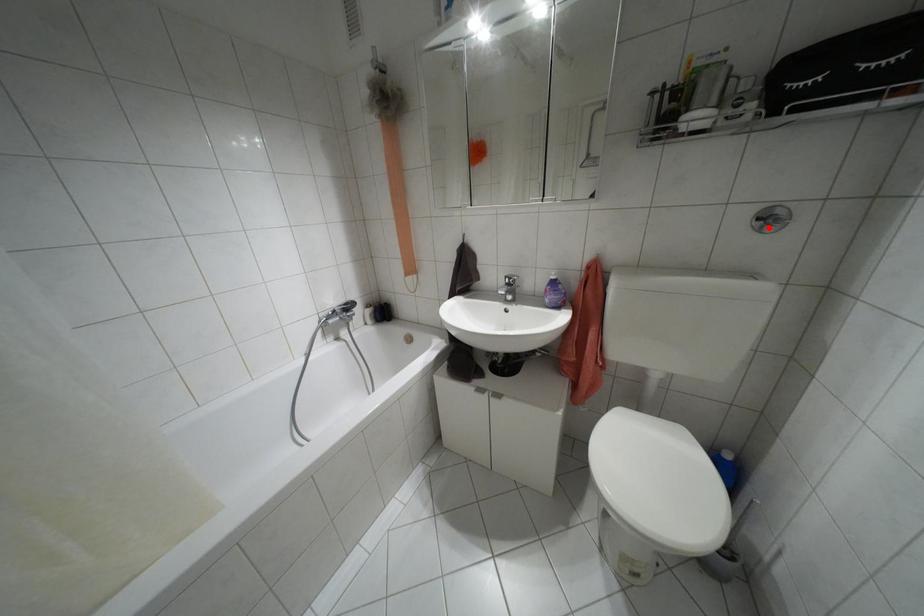
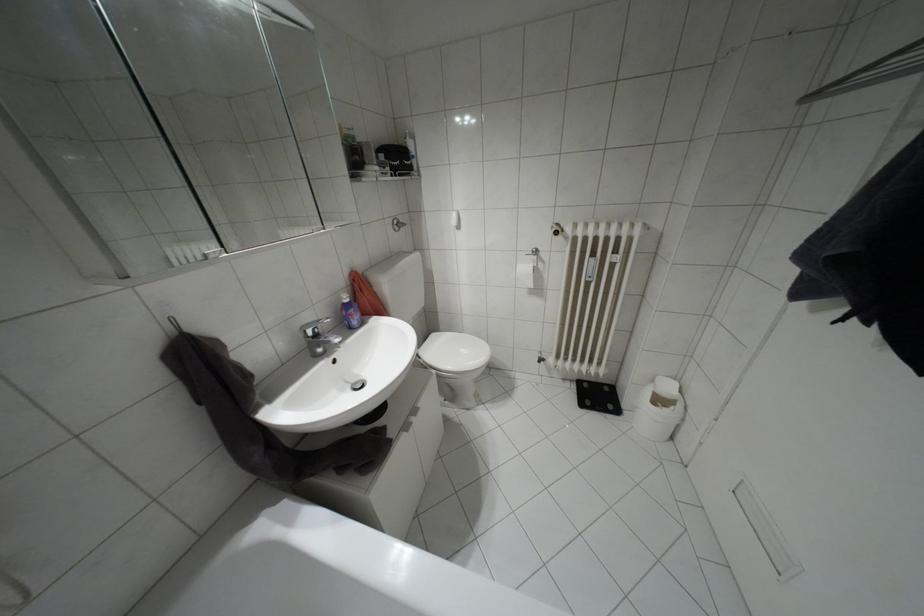
The point at the highlighted location is marked in the first image. Where is the corresponding point in the second image?

(395, 229)